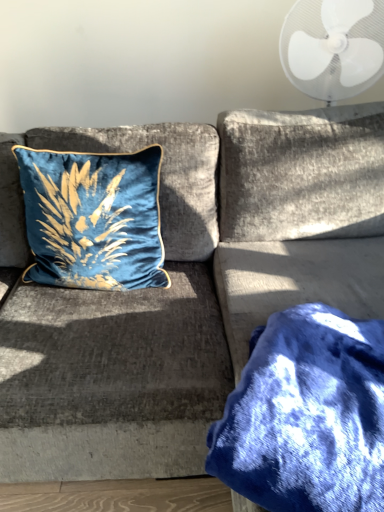
Question: Does blue fuzzy blanket at lower right appear on the left side of velvet blue pillow at upper left?

Choices:
 (A) no
 (B) yes

Answer: (A)

Question: Considering the relative positions of blue fuzzy blanket at lower right and velvet blue pillow at upper left in the image provided, is blue fuzzy blanket at lower right to the right of velvet blue pillow at upper left from the viewer's perspective?

Choices:
 (A) no
 (B) yes

Answer: (B)

Question: Is blue fuzzy blanket at lower right positioned behind velvet blue pillow at upper left?

Choices:
 (A) no
 (B) yes

Answer: (A)

Question: Is velvet blue pillow at upper left inside blue fuzzy blanket at lower right?

Choices:
 (A) no
 (B) yes

Answer: (A)

Question: Is blue fuzzy blanket at lower right not inside velvet blue pillow at upper left?

Choices:
 (A) yes
 (B) no

Answer: (A)

Question: Is velvet blue pillow at upper left taller or shorter than white plastic fan at upper right?

Choices:
 (A) short
 (B) tall

Answer: (B)

Question: Considering the positions of point (147, 174) and point (380, 17), is point (147, 174) closer or farther from the camera than point (380, 17)?

Choices:
 (A) farther
 (B) closer

Answer: (B)

Question: Is velvet blue pillow at upper left bigger or smaller than white plastic fan at upper right?

Choices:
 (A) small
 (B) big

Answer: (A)

Question: Considering their positions, is velvet blue pillow at upper left located in front of or behind white plastic fan at upper right?

Choices:
 (A) front
 (B) behind

Answer: (A)

Question: Considering the positions of blue fuzzy blanket at lower right and white plastic fan at upper right in the image, is blue fuzzy blanket at lower right bigger or smaller than white plastic fan at upper right?

Choices:
 (A) small
 (B) big

Answer: (A)

Question: From the image's perspective, is blue fuzzy blanket at lower right above or below white plastic fan at upper right?

Choices:
 (A) above
 (B) below

Answer: (B)

Question: From a real-world perspective, relative to white plastic fan at upper right, is blue fuzzy blanket at lower right vertically above or below?

Choices:
 (A) above
 (B) below

Answer: (B)

Question: Based on their positions, is blue fuzzy blanket at lower right located to the left or right of white plastic fan at upper right?

Choices:
 (A) left
 (B) right

Answer: (A)

Question: Is velvet blue pillow at upper left inside or outside of blue fuzzy blanket at lower right?

Choices:
 (A) inside
 (B) outside

Answer: (B)

Question: Considering the positions of velvet blue pillow at upper left and blue fuzzy blanket at lower right in the image, is velvet blue pillow at upper left wider or thinner than blue fuzzy blanket at lower right?

Choices:
 (A) thin
 (B) wide

Answer: (A)